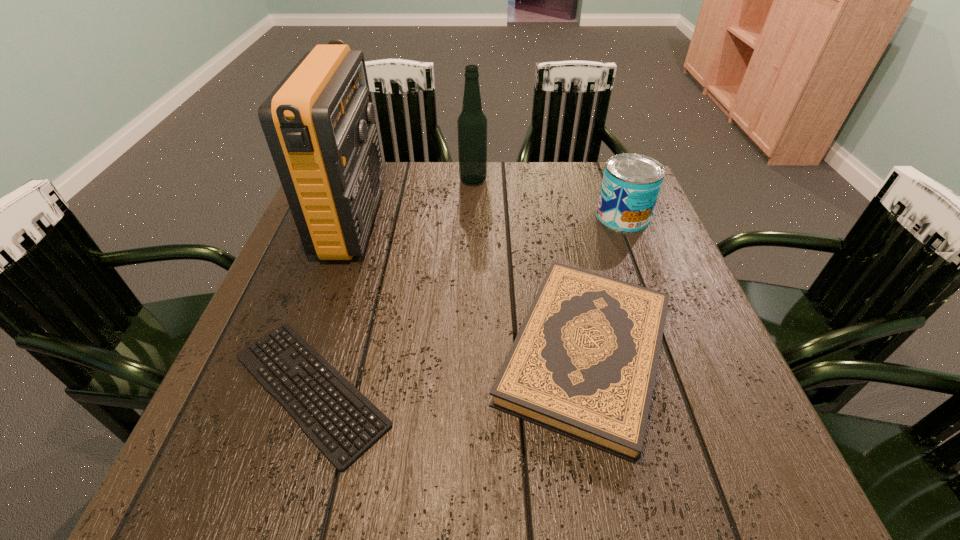
The height and width of the screenshot is (540, 960). In order to click on object located at the near left corner in this screenshot , I will do `click(284, 360)`.

Where is `object located in the far right corner section of the desktop`? object located in the far right corner section of the desktop is located at coordinates (631, 183).

Where is `object that is at the near right corner`? This screenshot has height=540, width=960. object that is at the near right corner is located at coordinates (583, 364).

Where is `free space at the far edge`? This screenshot has width=960, height=540. free space at the far edge is located at coordinates (401, 194).

Find the location of a particular element. Image resolution: width=960 pixels, height=540 pixels. vacant space at the near edge of the desktop is located at coordinates (345, 496).

Where is `vacant area at the right edge`? The height and width of the screenshot is (540, 960). vacant area at the right edge is located at coordinates (712, 386).

Locate an element on the screen. The image size is (960, 540). free region at the far right corner of the desktop is located at coordinates (580, 170).

This screenshot has width=960, height=540. In the image, there is a desktop. What are the coordinates of `vacant space at the near right corner` in the screenshot? It's located at tap(722, 470).

This screenshot has height=540, width=960. Identify the location of free area in between the can and the fourth shortest object. click(547, 198).

Image resolution: width=960 pixels, height=540 pixels. I want to click on vacant space that's between the fourth shortest object and the can, so click(x=547, y=198).